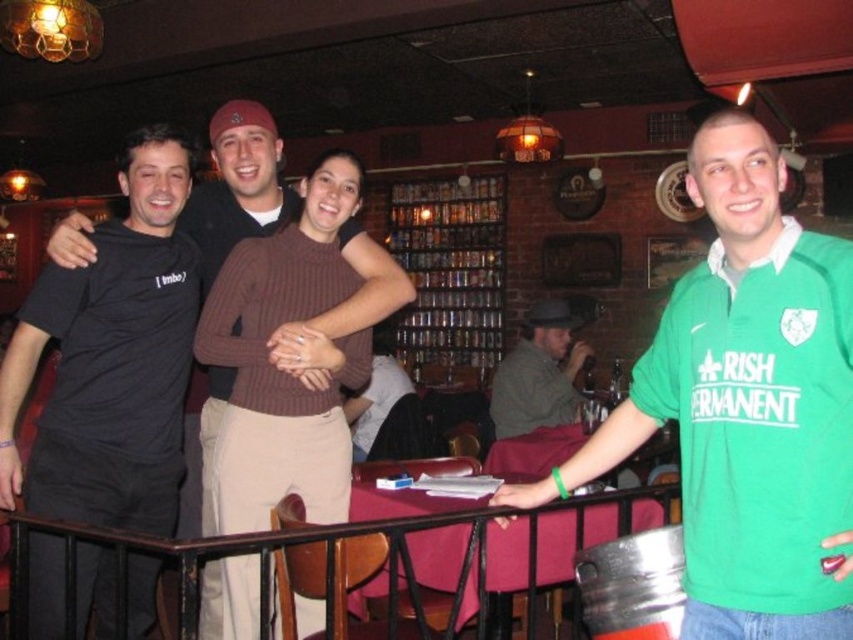
Consider the image. Does black matte t-shirt at center have a smaller size compared to gray wool hat at center?

Yes, black matte t-shirt at center is smaller than gray wool hat at center.

Is black matte t-shirt at center to the right of gray wool hat at center from the viewer's perspective?

Incorrect, black matte t-shirt at center is not on the right side of gray wool hat at center.

Is point (286, 337) farther from viewer compared to point (579, 342)?

That is False.

What are the coordinates of `black matte t-shirt at center` in the screenshot? It's located at (236, 186).

In the scene shown: Does black matte t-shirt at left come behind gray wool hat at center?

No, it is in front of gray wool hat at center.

Can you confirm if black matte t-shirt at left is smaller than gray wool hat at center?

Yes.

Between point (138, 337) and point (527, 376), which one is positioned behind?

The point (527, 376) is behind.

Identify the location of black matte t-shirt at left. Image resolution: width=853 pixels, height=640 pixels. (111, 358).

Can you confirm if green jersey at center is bigger than black matte t-shirt at center?

Actually, green jersey at center might be smaller than black matte t-shirt at center.

Which is more to the left, green jersey at center or black matte t-shirt at center?

black matte t-shirt at center

The height and width of the screenshot is (640, 853). Find the location of `green jersey at center`. green jersey at center is located at coordinates (746, 404).